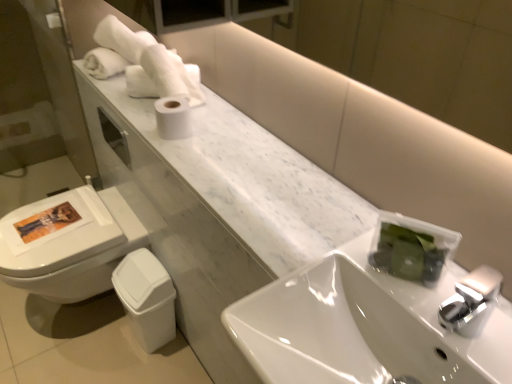
Question: Considering the relative sizes of white soft towel at upper left and white matte toilet paper at center in the image provided, is white soft towel at upper left wider than white matte toilet paper at center?

Choices:
 (A) no
 (B) yes

Answer: (B)

Question: From a real-world perspective, is white soft towel at upper left over white matte toilet paper at center?

Choices:
 (A) no
 (B) yes

Answer: (B)

Question: Can you confirm if white soft towel at upper left is bigger than white matte toilet paper at center?

Choices:
 (A) yes
 (B) no

Answer: (A)

Question: From a real-world perspective, is white soft towel at upper left physically below white matte toilet paper at center?

Choices:
 (A) no
 (B) yes

Answer: (A)

Question: Can you confirm if white soft towel at upper left is smaller than white matte toilet paper at center?

Choices:
 (A) yes
 (B) no

Answer: (B)

Question: From a real-world perspective, is white soft towel at upper left physically located above or below white marble counter at upper left?

Choices:
 (A) below
 (B) above

Answer: (B)

Question: Is white soft towel at upper left in front of or behind white marble counter at upper left in the image?

Choices:
 (A) front
 (B) behind

Answer: (B)

Question: Visually, is white soft towel at upper left positioned to the left or to the right of white marble counter at upper left?

Choices:
 (A) left
 (B) right

Answer: (A)

Question: From the image's perspective, is white soft towel at upper left positioned above or below white marble counter at upper left?

Choices:
 (A) below
 (B) above

Answer: (B)

Question: Considering the positions of white soft towel at upper left and white glossy sink at center in the image, is white soft towel at upper left taller or shorter than white glossy sink at center?

Choices:
 (A) tall
 (B) short

Answer: (A)

Question: From the image's perspective, is white soft towel at upper left above or below white glossy sink at center?

Choices:
 (A) below
 (B) above

Answer: (B)

Question: Looking at the image, does white soft towel at upper left seem bigger or smaller compared to white glossy sink at center?

Choices:
 (A) big
 (B) small

Answer: (B)

Question: Is white soft towel at upper left to the left or to the right of white glossy sink at center in the image?

Choices:
 (A) right
 (B) left

Answer: (B)

Question: Looking at the image, does white glossy sink at center seem bigger or smaller compared to white marble counter at upper left?

Choices:
 (A) small
 (B) big

Answer: (B)

Question: Visually, is white glossy sink at center positioned to the left or to the right of white marble counter at upper left?

Choices:
 (A) right
 (B) left

Answer: (A)